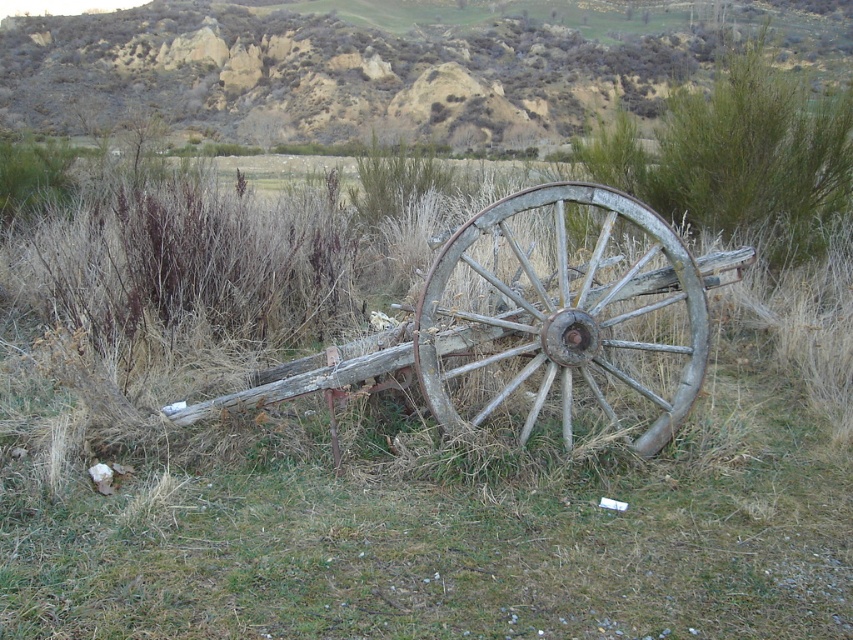
Question: Which object is the closest to the brown textured hillside at upper center?

Choices:
 (A) weathered wood cart at center
 (B) weathered wood wagon wheel at center

Answer: (B)

Question: Is brown textured hillside at upper center wider than weathered wood cart at center?

Choices:
 (A) yes
 (B) no

Answer: (A)

Question: Is brown textured hillside at upper center to the left of weathered wood cart at center from the viewer's perspective?

Choices:
 (A) no
 (B) yes

Answer: (B)

Question: Is weathered wood cart at center wider than weathered wood wagon wheel at center?

Choices:
 (A) no
 (B) yes

Answer: (B)

Question: Among these objects, which one is nearest to the camera?

Choices:
 (A) weathered wood cart at center
 (B) weathered wood wagon wheel at center
 (C) brown textured hillside at upper center

Answer: (A)

Question: Which of the following is the farthest from the observer?

Choices:
 (A) (543, 225)
 (B) (743, 6)

Answer: (B)